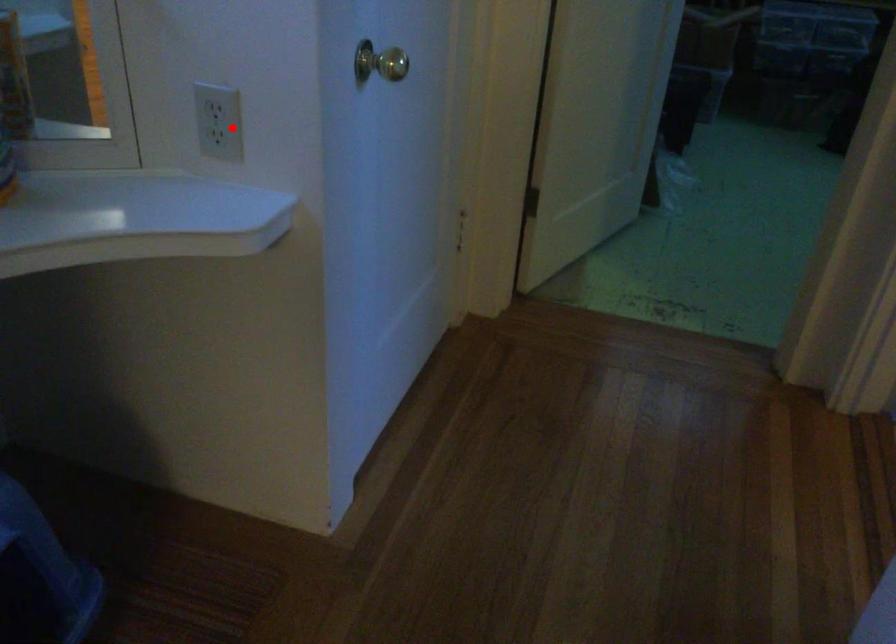
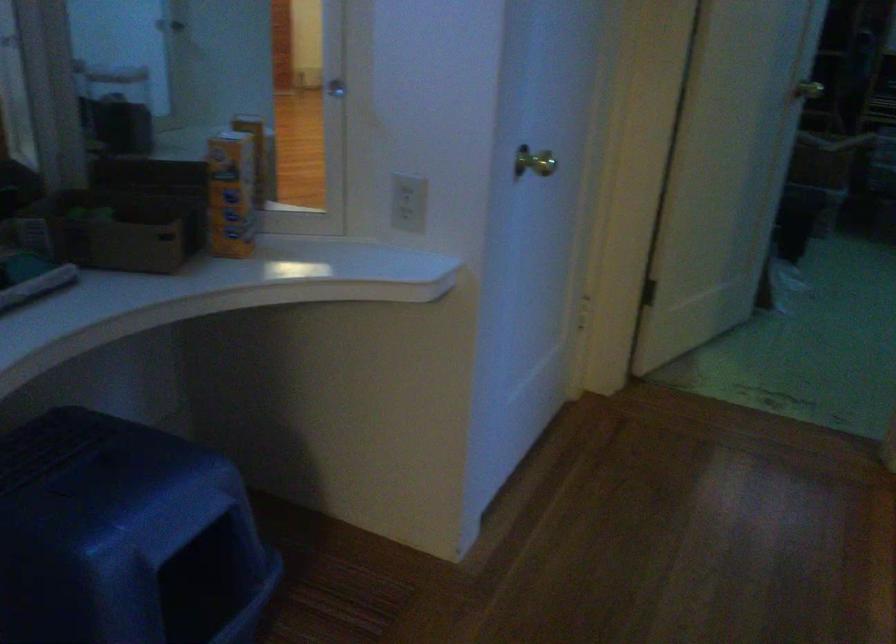
Question: I am providing you with two images of the same scene from different viewpoints. A red point is marked on the first image. Is the red point's position out of view in image 2?

Choices:
 (A) Yes
 (B) No

Answer: (B)